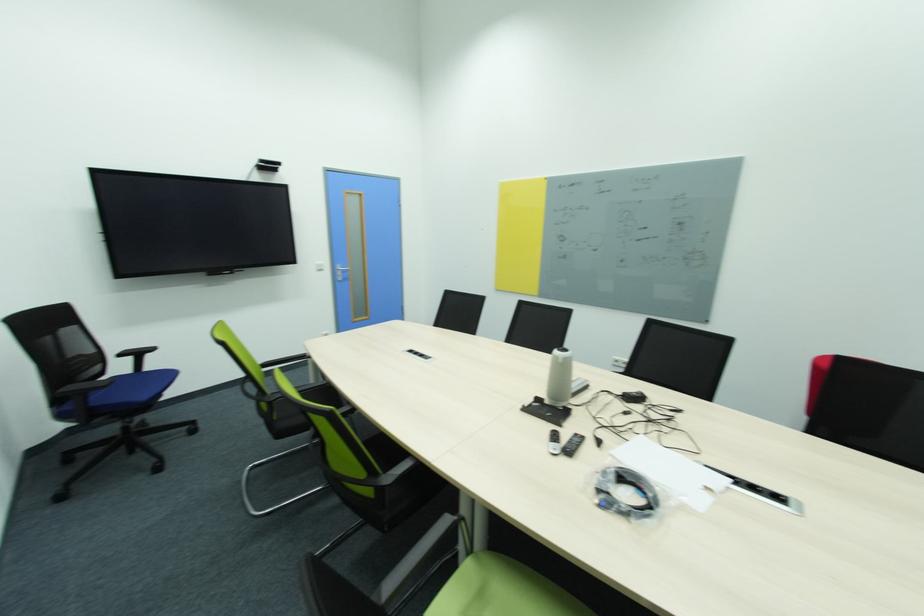
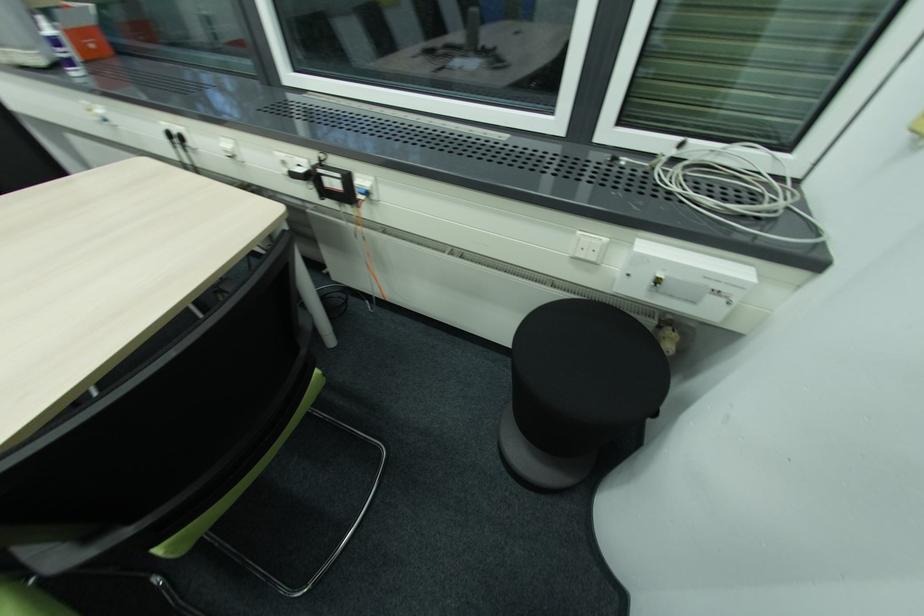
Looking at this image, based on the continuous images, in which direction is the camera rotating?

The camera rotated toward right-down.